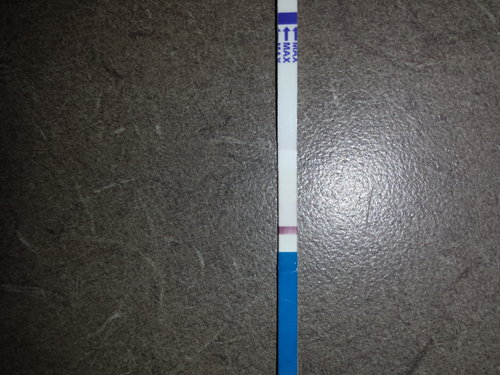
Where is `vinyl or other synthetic flooring maybe`? The image size is (500, 375). vinyl or other synthetic flooring maybe is located at coordinates (198, 217).